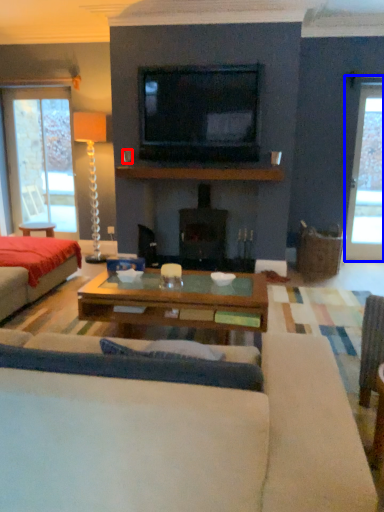
Question: Which of the following is the farthest to the observer, coffee cup (highlighted by a red box) or window (highlighted by a blue box)?

Choices:
 (A) coffee cup
 (B) window

Answer: (B)